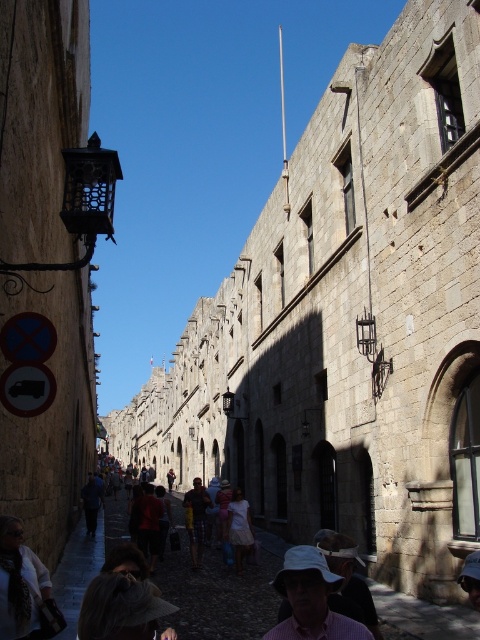
Does white textured shirt at lower left appear over white cotton dress at center?

Yes, white textured shirt at lower left is above white cotton dress at center.

Can you confirm if white textured shirt at lower left is bigger than white cotton dress at center?

Actually, white textured shirt at lower left might be smaller than white cotton dress at center.

This screenshot has height=640, width=480. I want to click on white textured shirt at lower left, so click(x=20, y=582).

The image size is (480, 640). Find the location of `white textured shirt at lower left`. white textured shirt at lower left is located at coordinates 20,582.

Consider the image. Can you confirm if white cotton dress at center is shorter than yellow cotton shirt at center?

Indeed, white cotton dress at center has a lesser height compared to yellow cotton shirt at center.

Does white cotton dress at center have a lesser width compared to yellow cotton shirt at center?

Yes, white cotton dress at center is thinner than yellow cotton shirt at center.

Locate an element on the screen. white cotton dress at center is located at coordinates (239, 528).

Image resolution: width=480 pixels, height=640 pixels. Identify the location of white cotton dress at center. (239, 528).

Between point (313, 560) and point (26, 634), which one is positioned in front?

Point (26, 634) is in front.

Does pink checkered shirt at lower center come behind white textured shirt at lower left?

No, it is not.

Measure the distance between point (321, 554) and camera.

37.02 meters

Identify the location of pink checkered shirt at lower center. The height and width of the screenshot is (640, 480). (314, 600).